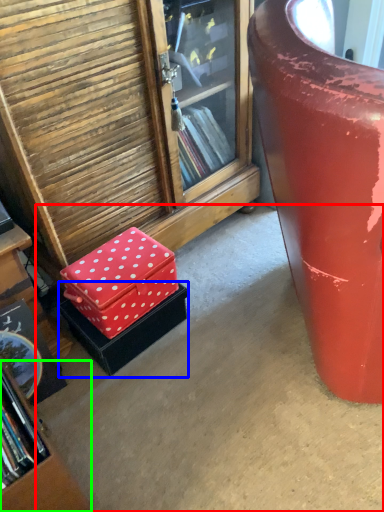
Question: Based on their relative distances, which object is farther from concrete (highlighted by a red box)? Choose from box (highlighted by a blue box) and bookcase (highlighted by a green box).

Choices:
 (A) box
 (B) bookcase

Answer: (B)